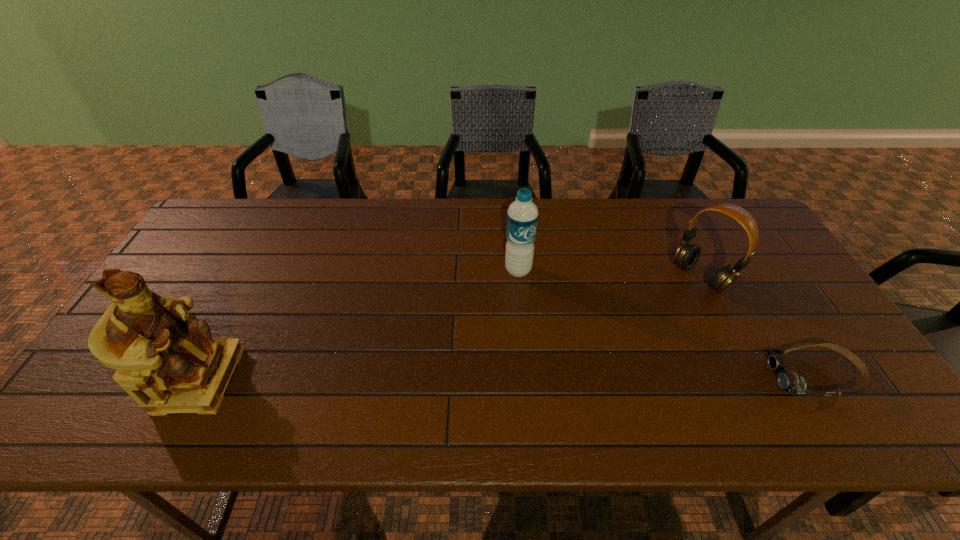
Find the location of a particular element. This screenshot has height=540, width=960. free space located 0.120m on the label of the third shortest object is located at coordinates (540, 309).

The height and width of the screenshot is (540, 960). Identify the location of vacant area situated on the label of the third shortest object. 585,390.

The width and height of the screenshot is (960, 540). I want to click on vacant region located 0.260m on the label of the third shortest object, so click(563, 350).

This screenshot has height=540, width=960. I want to click on vacant space situated on the ear cups of the headset, so click(643, 322).

Where is `free spot located on the ear cups of the headset`? The image size is (960, 540). free spot located on the ear cups of the headset is located at coordinates (637, 326).

This screenshot has height=540, width=960. I want to click on vacant space located on the ear cups of the headset, so click(x=655, y=313).

In order to click on figurine that is positioned at the near edge in this screenshot , I will do `click(166, 359)`.

Find the location of `goggles that is at the near edge`. goggles that is at the near edge is located at coordinates (790, 382).

Image resolution: width=960 pixels, height=540 pixels. I want to click on object situated at the right edge, so click(790, 382).

Identify the location of object at the near right corner. (790, 382).